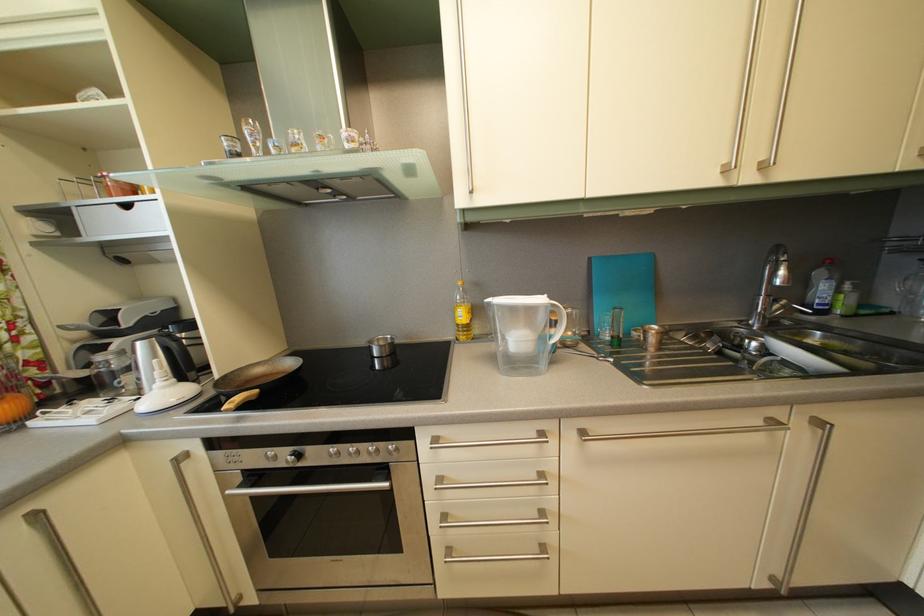
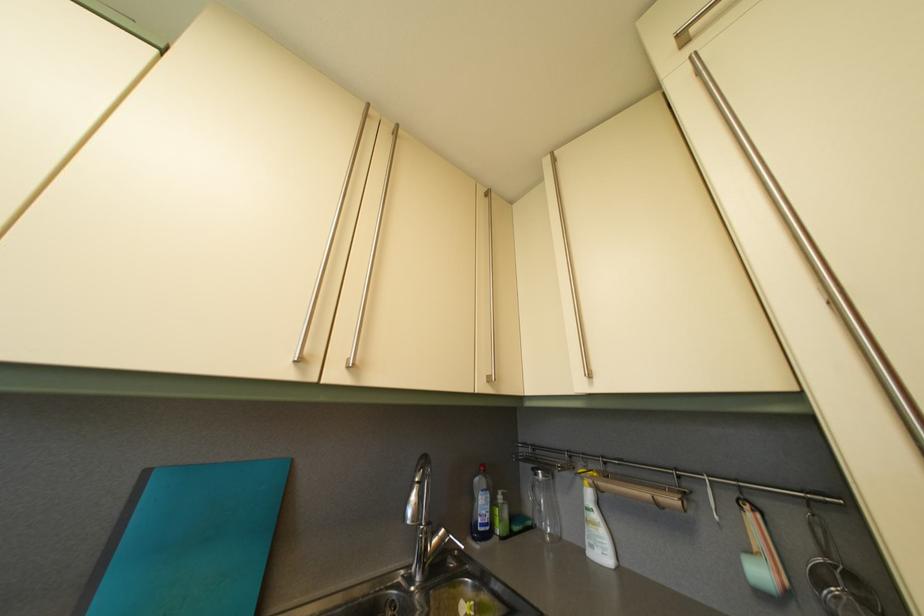
In the second image, find the point that corresponds to [598,267] in the first image.

(154, 480)